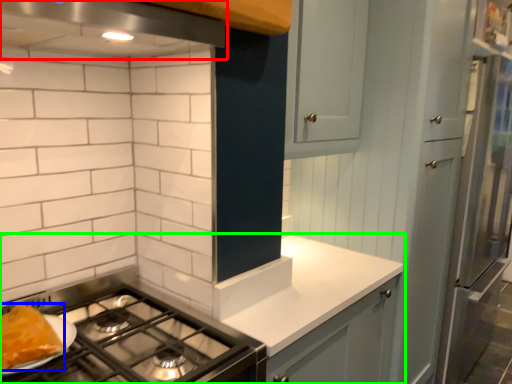
Question: Which is farther away from exhaust hood (highlighted by a red box)? food (highlighted by a blue box) or countertop (highlighted by a green box)?

Choices:
 (A) food
 (B) countertop

Answer: (B)